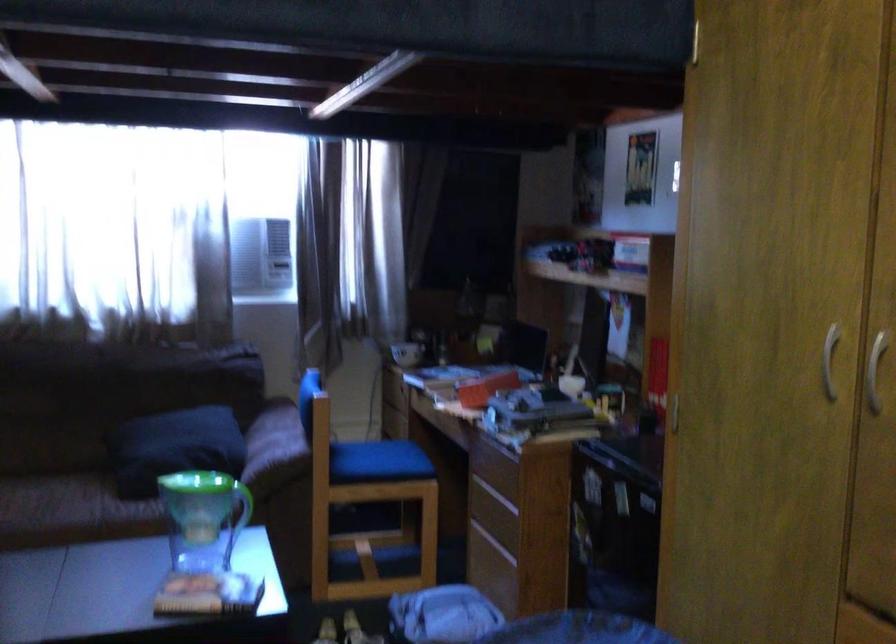
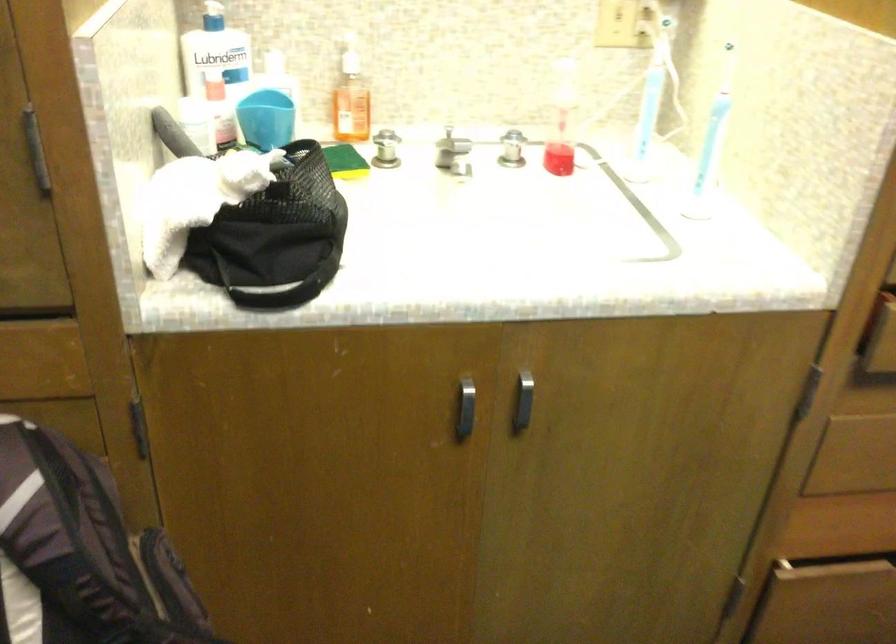
Based on the continuous images, in which direction is the camera rotating?

The rotation direction of the camera is right-down.